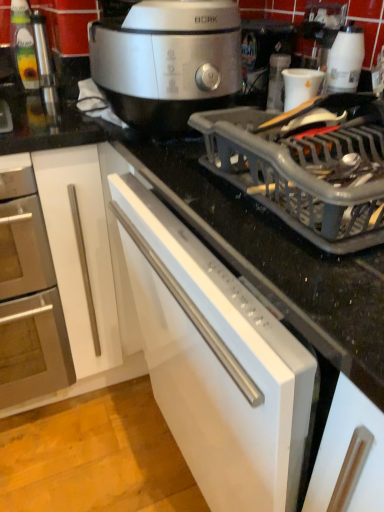
Question: Looking at the image, does white matte dishwasher at center seem bigger or smaller compared to brushed metal oven at left?

Choices:
 (A) small
 (B) big

Answer: (B)

Question: Considering the relative positions of white matte dishwasher at center and brushed metal oven at left in the image provided, is white matte dishwasher at center to the left or to the right of brushed metal oven at left?

Choices:
 (A) left
 (B) right

Answer: (B)

Question: Estimate the real-world distances between objects in this image. Which object is closer to the satin silver slow cooker at upper center?

Choices:
 (A) white plastic coffee machine at upper right
 (B) white matte dishwasher at center
 (C) brushed metal oven at left
 (D) gray plastic dish rack at upper right
 (E) white glossy cup at upper right

Answer: (D)

Question: Estimate the real-world distances between objects in this image. Which object is farther from the brushed metal oven at left?

Choices:
 (A) white plastic coffee machine at upper right
 (B) white glossy cup at upper right
 (C) satin silver slow cooker at upper center
 (D) white matte dishwasher at center
 (E) gray plastic dish rack at upper right

Answer: (B)